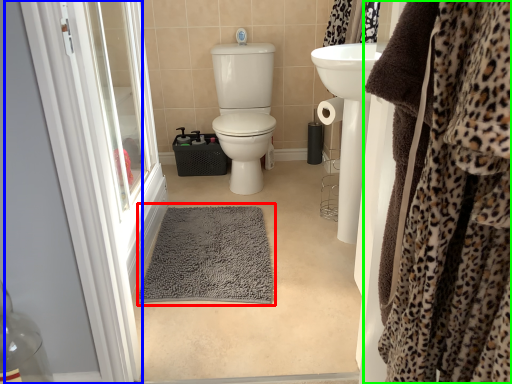
Question: Considering the real-world distances, which object is farthest from bath mat (highlighted by a red box)? screen door (highlighted by a blue box) or clothing (highlighted by a green box)?

Choices:
 (A) screen door
 (B) clothing

Answer: (B)